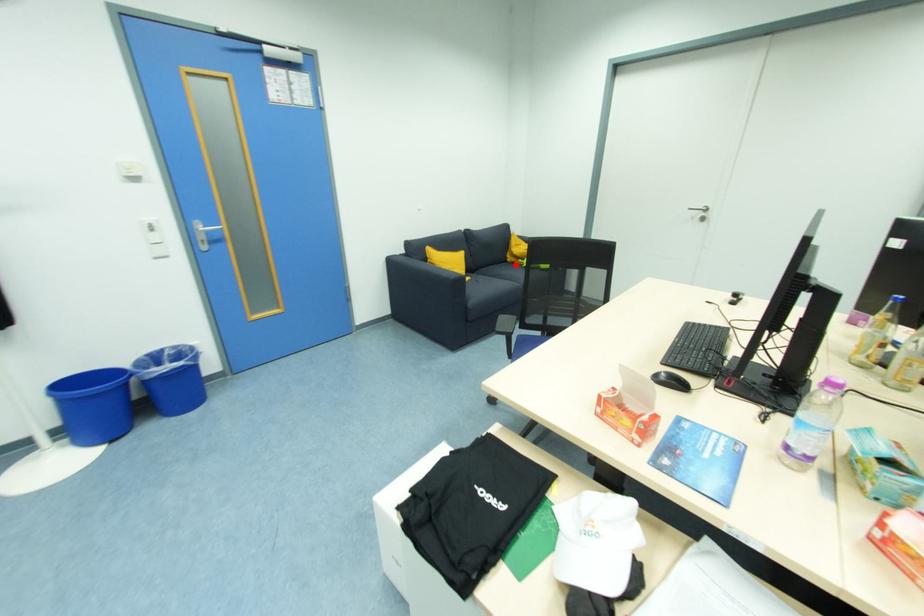
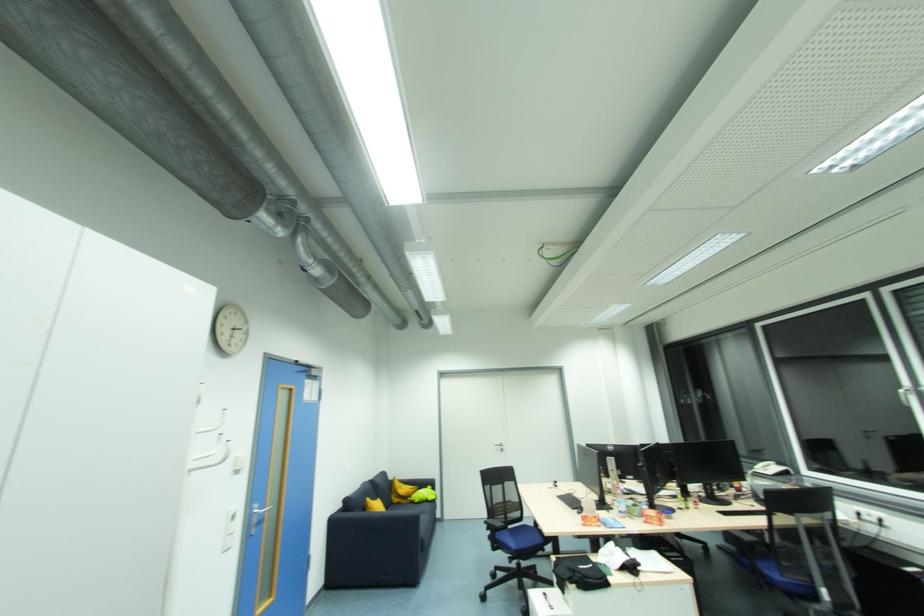
Where in the second image is the point corresponding to the highlighted location from the first image?

(400, 505)